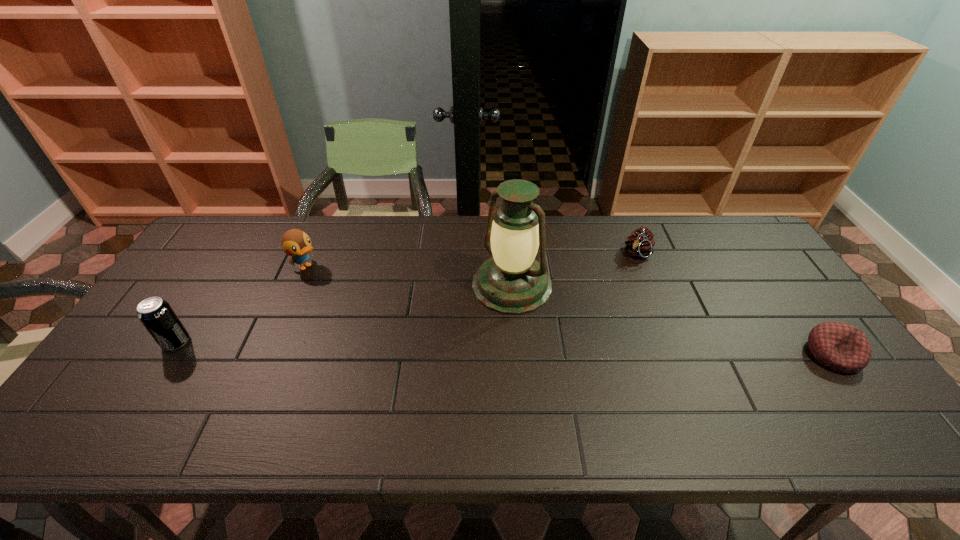
The height and width of the screenshot is (540, 960). In order to click on vacant area that lies between the duck and the second shortest object in this screenshot , I will do `click(472, 260)`.

Image resolution: width=960 pixels, height=540 pixels. Identify the location of empty space between the fourth tallest object and the soda can. (407, 298).

Identify the location of object that stands as the fourth closest to the leftmost object. (839, 346).

Locate an element on the screen. object that stands as the third closest to the pinecone is located at coordinates (295, 243).